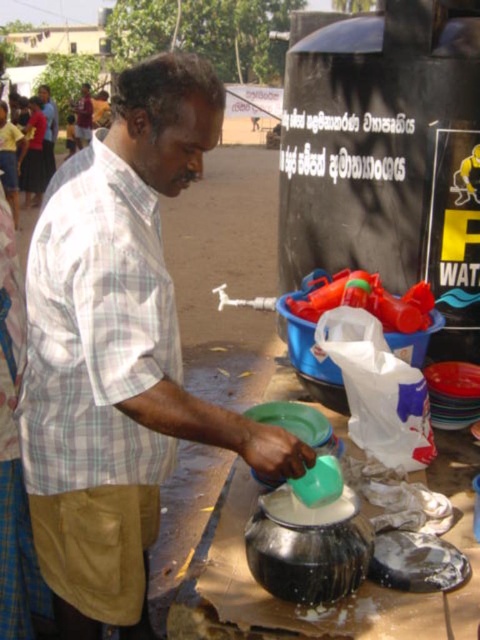
Question: Is plaid cotton shirt at center closer to the viewer compared to matte white shirt at center?

Choices:
 (A) no
 (B) yes

Answer: (B)

Question: Observing the image, what is the correct spatial positioning of plaid cotton shirt at center in reference to matte white shirt at center?

Choices:
 (A) left
 (B) right

Answer: (B)

Question: In this image, where is plaid cotton shirt at center located relative to matte white shirt at center?

Choices:
 (A) above
 (B) below

Answer: (B)

Question: Which point is farther to the camera?

Choices:
 (A) (98, 486)
 (B) (84, 132)

Answer: (B)

Question: Which point is farther to the camera?

Choices:
 (A) 80,132
 (B) 152,536

Answer: (A)